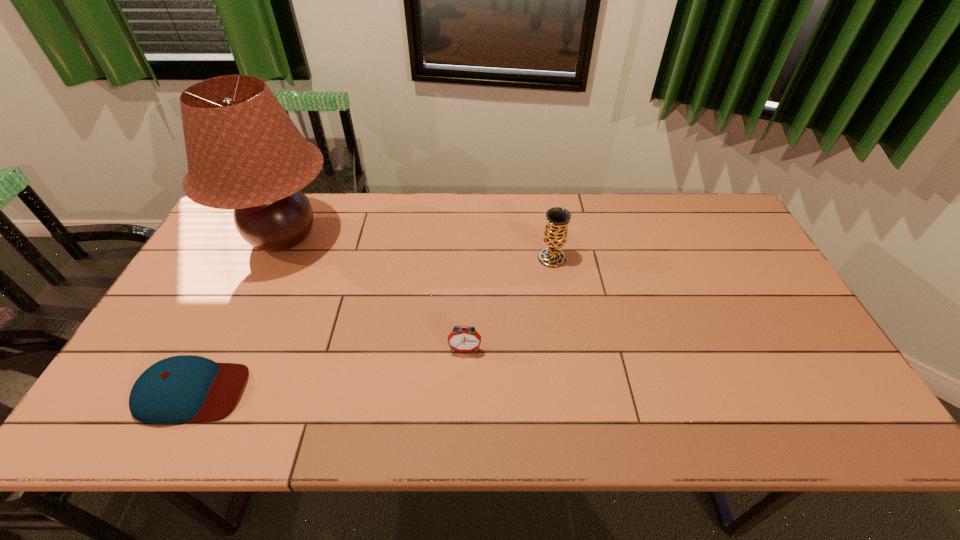
You are a GUI agent. You are given a task and a screenshot of the screen. Output one action in this format:
    pyautogui.click(x=<x>, y=<y>)
    Task: Click on the lampshade
    
    Given the screenshot: What is the action you would take?
    pyautogui.click(x=244, y=152)

Identify the location of chalice. (557, 219).

This screenshot has height=540, width=960. In order to click on the rightmost object in this screenshot , I will do `click(557, 219)`.

What are the coordinates of `the second nearest object` in the screenshot? It's located at (460, 339).

Identify the location of alarm clock. (460, 339).

Locate an element on the screen. Image resolution: width=960 pixels, height=540 pixels. the nearest object is located at coordinates (186, 388).

I want to click on the shortest object, so click(x=186, y=388).

Where is `free region located on the front-facing side of the lampshade`? This screenshot has width=960, height=540. free region located on the front-facing side of the lampshade is located at coordinates (251, 309).

Identify the location of free location located 0.190m on the front of the third shortest object. (562, 319).

Locate an element on the screen. This screenshot has height=540, width=960. free space located 0.070m on the clock face of the alarm clock is located at coordinates (464, 380).